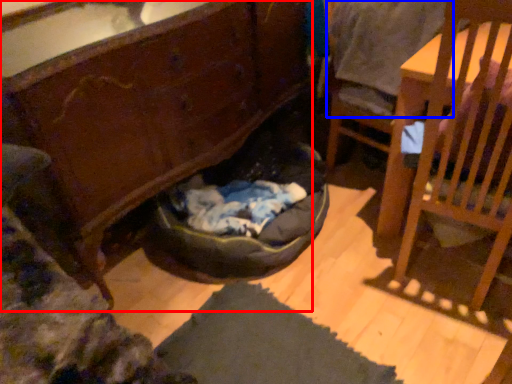
Question: Which object is closer to the camera taking this photo, cabinetry (highlighted by a red box) or clothing (highlighted by a blue box)?

Choices:
 (A) cabinetry
 (B) clothing

Answer: (A)